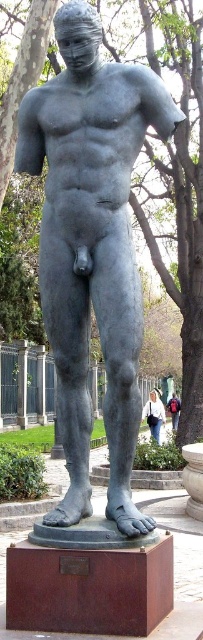
Question: Is matte gray statue at center above red backpack at center?

Choices:
 (A) no
 (B) yes

Answer: (B)

Question: Which of the following is the closest to the observer?

Choices:
 (A) white cotton shirt at lower center
 (B) matte gray statue at center
 (C) red backpack at center

Answer: (B)

Question: Which point is farther to the camera?

Choices:
 (A) red backpack at center
 (B) matte gray statue at center

Answer: (A)

Question: Which object is the farthest from the white cotton shirt at lower center?

Choices:
 (A) matte gray statue at center
 (B) red backpack at center

Answer: (A)

Question: From the image, what is the correct spatial relationship of matte gray statue at center in relation to white cotton shirt at lower center?

Choices:
 (A) above
 (B) below

Answer: (A)

Question: Where is white cotton shirt at lower center located in relation to red backpack at center in the image?

Choices:
 (A) right
 (B) left

Answer: (B)